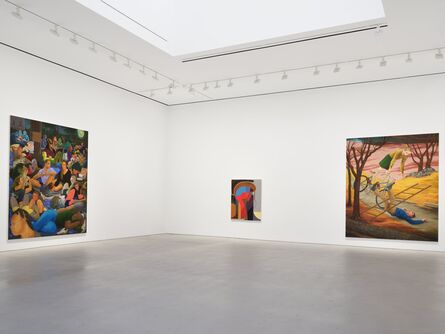
The image size is (445, 334). I want to click on white walls, so click(132, 161), click(188, 160).